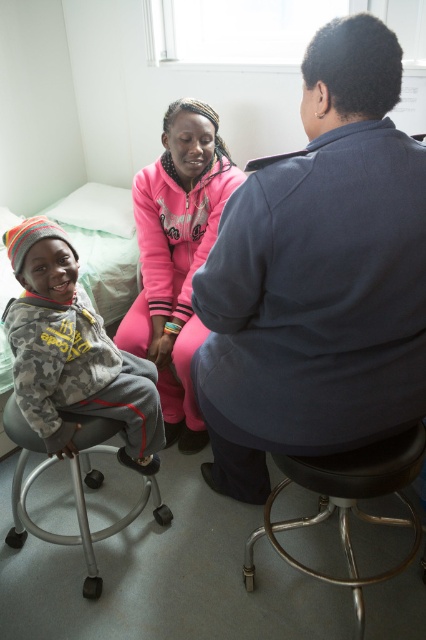
You are a photographer setting up for a photo shoot in this room. You need to position a small tripod between the camouflage sweatshirt at left and the black metal bar stool at lower center. Considering their heights, which object should the tripod be placed closer to to ensure it doesn

The camouflage sweatshirt at left is much taller than the black metal bar stool at lower center. To ensure the tripod is positioned appropriately between them based on their heights, it should be placed closer to the black metal bar stool at lower center since it is shorter.

From the picture: You are a visitor in this medical office and need to sit down. There is a dark blue uniform at center and a black metal bar stool at lower center. Which one should you sit on?

You should sit on the black metal bar stool at lower center because the dark blue uniform at center is likely worn by a person and not a seating option.